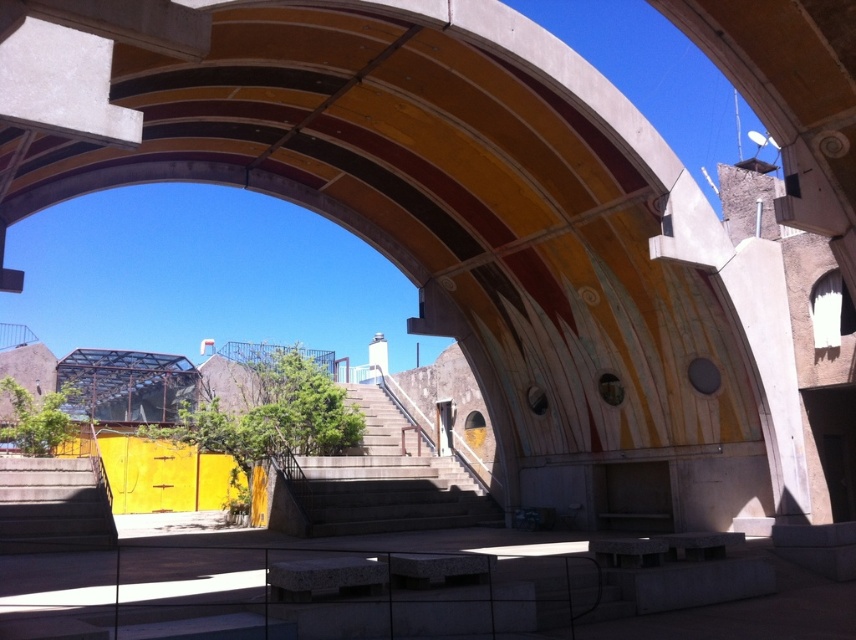
What do you see at coordinates (379, 483) in the screenshot?
I see `concrete stairs at center` at bounding box center [379, 483].

Does concrete stairs at center appear on the right side of gray concrete stairs at lower left?

Correct, you'll find concrete stairs at center to the right of gray concrete stairs at lower left.

Is point (453, 522) positioned in front of point (63, 497)?

That is False.

This screenshot has width=856, height=640. Identify the location of concrete stairs at center. (379, 483).